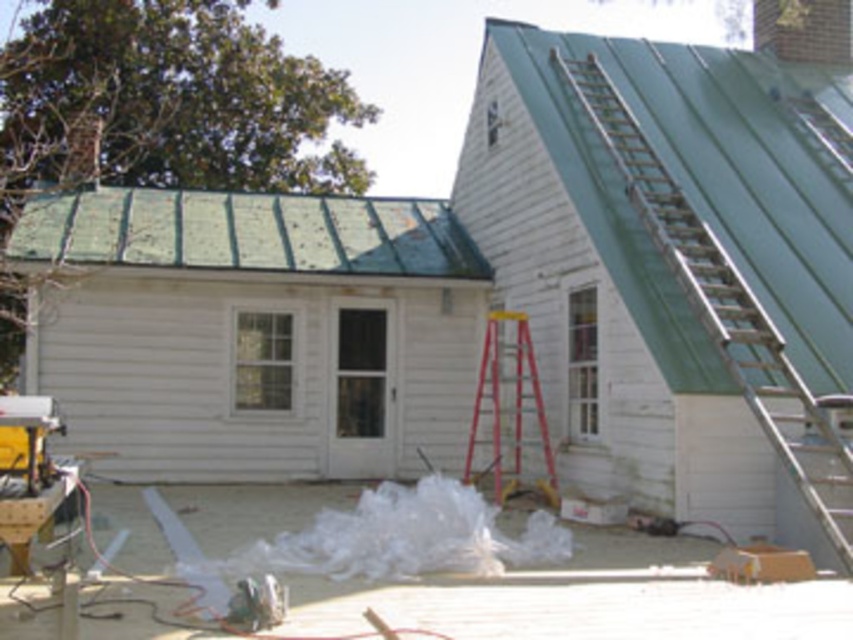
Question: Which of the following is the closest to the observer?

Choices:
 (A) green metal roof at upper left
 (B) brick chimney at upper right
 (C) red plastic ladder at center
 (D) metallic silver ladder at upper right

Answer: (D)

Question: Which is farther from the brick chimney at upper right?

Choices:
 (A) green metal roof at upper left
 (B) metallic silver ladder at upper right
 (C) red plastic ladder at center

Answer: (B)

Question: Can you confirm if red plastic ladder at center is thinner than brick chimney at upper right?

Choices:
 (A) no
 (B) yes

Answer: (B)

Question: Can you confirm if metallic silver ladder at upper right is smaller than brick chimney at upper right?

Choices:
 (A) yes
 (B) no

Answer: (A)

Question: Is green metal roof at upper left behind red plastic ladder at center?

Choices:
 (A) no
 (B) yes

Answer: (B)

Question: Which of the following is the closest to the observer?

Choices:
 (A) (809, 58)
 (B) (608, 140)
 (C) (26, 205)

Answer: (B)